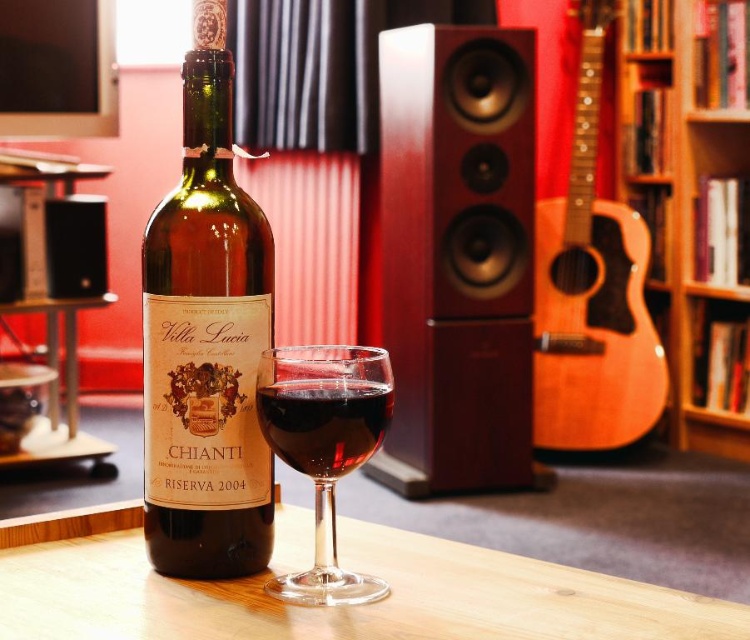
Is ruby glass at center to the right of black matte speaker at lower left from the viewer's perspective?

Correct, you'll find ruby glass at center to the right of black matte speaker at lower left.

Who is higher up, ruby glass at center or black matte speaker at lower left?

Positioned higher is black matte speaker at lower left.

Does point (334, 401) come behind point (58, 227)?

That is False.

I want to click on ruby glass at center, so click(324, 422).

Is mahogany wood speaker at center taller than black matte speaker at lower left?

Yes, mahogany wood speaker at center is taller than black matte speaker at lower left.

Is mahogany wood speaker at center shorter than black matte speaker at lower left?

No.

Between point (534, 186) and point (87, 227), which one is positioned behind?

The point (534, 186) is behind.

This screenshot has width=750, height=640. What are the coordinates of `mahogany wood speaker at center` in the screenshot? It's located at (458, 257).

Is natural wood acoustic guitar at center right thinner than black matte speaker at lower left?

Answer: No.

Is point (638, 326) positioned behind point (84, 276)?

Yes.

Where is `natural wood acoustic guitar at center right`? natural wood acoustic guitar at center right is located at coordinates coord(592,292).